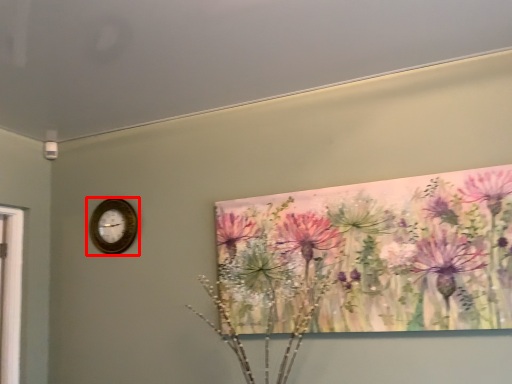
Question: From the image's perspective, what is the correct spatial relationship of wall clock (annotated by the red box) in relation to flower?

Choices:
 (A) above
 (B) below

Answer: (A)